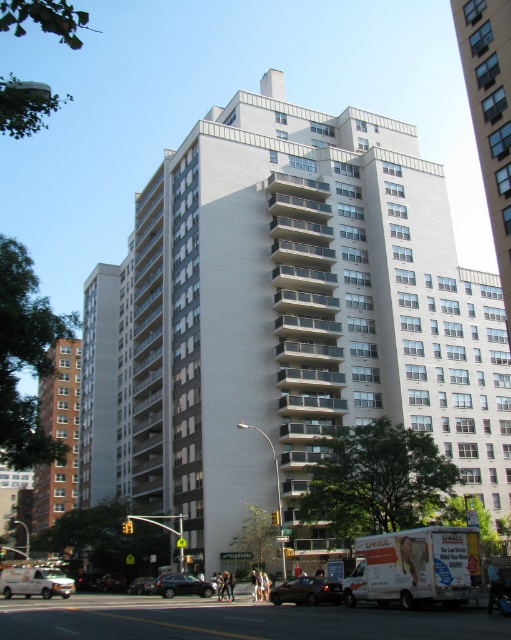
You are a delivery driver who needs to park your truck between the brown brick building at center and the black glossy sedan at center. Given that your truck is 10 meters long, can you fit it in the space between them?

The brown brick building at center is larger than the black glossy sedan at center, but the exact distance between them isn not provided. Without knowing the actual space available, it is impossible to determine if the truck will fit.

You are a delivery driver who needs to park your truck between the white concrete building at center and the silver metallic sedan at center. Is there enough space between them for your truck?

The white concrete building at center is positioned over the silver metallic sedan at center, which means there is no space between them. Therefore, there is insufficient space to park your truck between them.

You are standing at the intersection and want to locate the brown brick building at center. According to the coordinates provided, where exactly is it located?

The brown brick building at center is located at point [58,435].